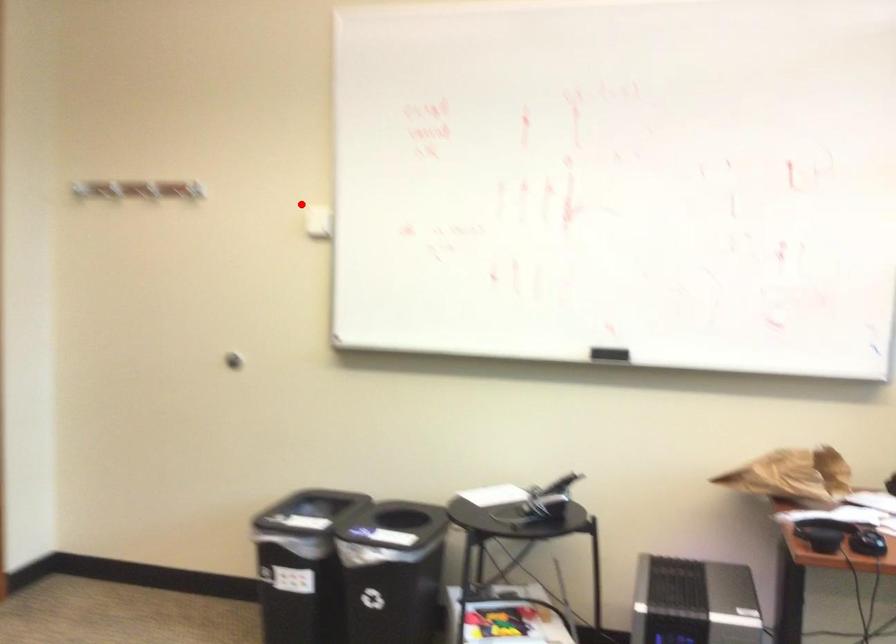
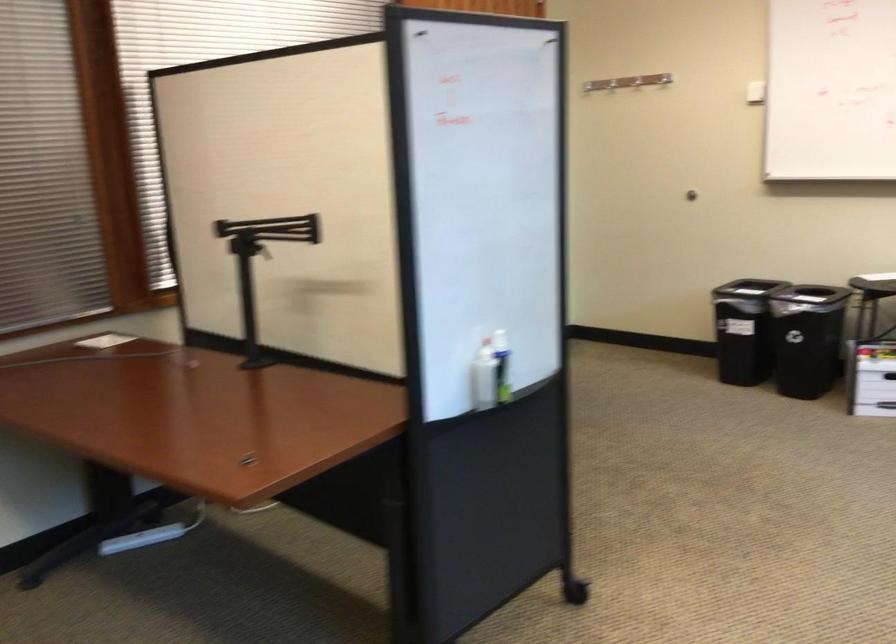
Question: A red point is marked in image1. In image2, is the corresponding 3D point closer to the camera or farther? Reply with the corresponding letter.

Choices:
 (A) The corresponding 3D point is closer.
 (B) The corresponding 3D point is farther.

Answer: (B)